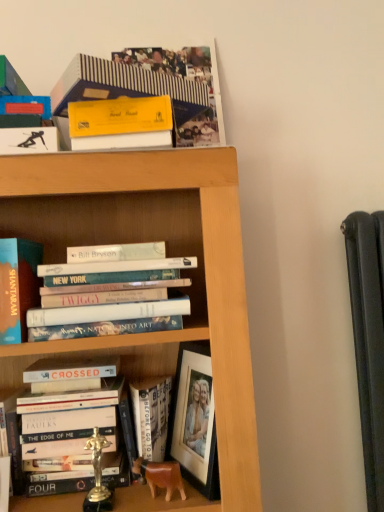
Question: From a real-world perspective, is matte blue book at left, the third book positioned from the bottom, positioned under hardcover book at lower left, which appears as the 4th book when viewed from the top, based on gravity?

Choices:
 (A) yes
 (B) no

Answer: (B)

Question: Is matte blue book at left, the third book positioned from the bottom, beside hardcover book at lower left, marked as the 2th book in a bottom-to-top arrangement?

Choices:
 (A) yes
 (B) no

Answer: (B)

Question: Is hardcover book at lower left, which appears as the 4th book when viewed from the top, surrounded by matte blue book at left, the third book positioned from the bottom?

Choices:
 (A) yes
 (B) no

Answer: (B)

Question: Does matte blue book at left, placed as the 3th book when sorted from top to bottom, lie in front of hardcover book at lower left, marked as the 2th book in a bottom-to-top arrangement?

Choices:
 (A) yes
 (B) no

Answer: (A)

Question: Is hardcover book at lower left, which appears as the 4th book when viewed from the top, at the back of matte blue book at left, placed as the 3th book when sorted from top to bottom?

Choices:
 (A) yes
 (B) no

Answer: (B)

Question: Is matte blue book at left, placed as the 3th book when sorted from top to bottom, to the right of hardcover book at lower left, marked as the 2th book in a bottom-to-top arrangement, from the viewer's perspective?

Choices:
 (A) yes
 (B) no

Answer: (B)

Question: From a real-world perspective, is matte blue book at left, the third book positioned from the bottom, below striped paper book at upper center, acting as the first book starting from the top?

Choices:
 (A) yes
 (B) no

Answer: (A)

Question: Does matte blue book at left, placed as the 3th book when sorted from top to bottom, come in front of striped paper book at upper center, which is the 5th book from bottom to top?

Choices:
 (A) yes
 (B) no

Answer: (B)

Question: Can you confirm if matte blue book at left, placed as the 3th book when sorted from top to bottom, is positioned to the right of striped paper book at upper center, which is the 5th book from bottom to top?

Choices:
 (A) no
 (B) yes

Answer: (A)

Question: Is matte blue book at left, the third book positioned from the bottom, shorter than striped paper book at upper center, acting as the first book starting from the top?

Choices:
 (A) yes
 (B) no

Answer: (B)

Question: From the image's perspective, would you say matte blue book at left, the third book positioned from the bottom, is positioned over striped paper book at upper center, which is the 5th book from bottom to top?

Choices:
 (A) yes
 (B) no

Answer: (B)

Question: Can you confirm if matte blue book at left, the third book positioned from the bottom, is thinner than striped paper book at upper center, acting as the first book starting from the top?

Choices:
 (A) yes
 (B) no

Answer: (A)

Question: Considering the relative sizes of striped paper book at upper center, which is the 5th book from bottom to top, and matte blue book at left, placed as the 3th book when sorted from top to bottom, in the image provided, is striped paper book at upper center, which is the 5th book from bottom to top, taller than matte blue book at left, placed as the 3th book when sorted from top to bottom,?

Choices:
 (A) no
 (B) yes

Answer: (A)